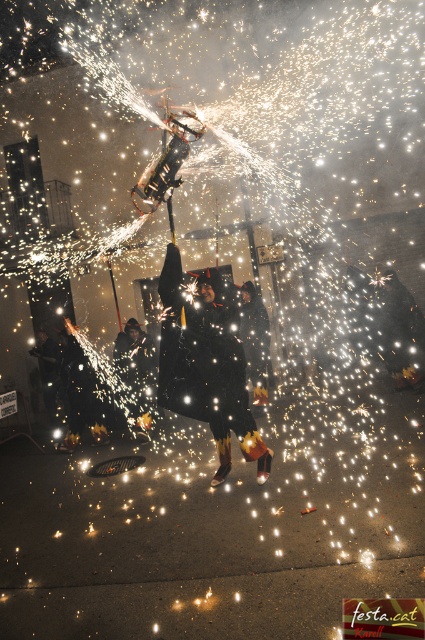
You are a photographer trying to capture the sparks in the background. You see the black leather jacket at center and the matte black jacket at lower left. Which jacket is positioned closer to the right side of the frame?

The black leather jacket at center is to the right of matte black jacket at lower left, so it is positioned closer to the right side of the frame.

You are a photographer trying to capture the scene. You want to ensure that both the black matte coat at center and the matte black jacket at lower left are clearly visible in your photo. Given their sizes, which object might require more careful framing to avoid being overshadowed by the bright sparks?

The matte black jacket at lower left requires more careful framing because it is smaller in width compared to the black matte coat at center, making it easier to be overshadowed by the bright sparks.